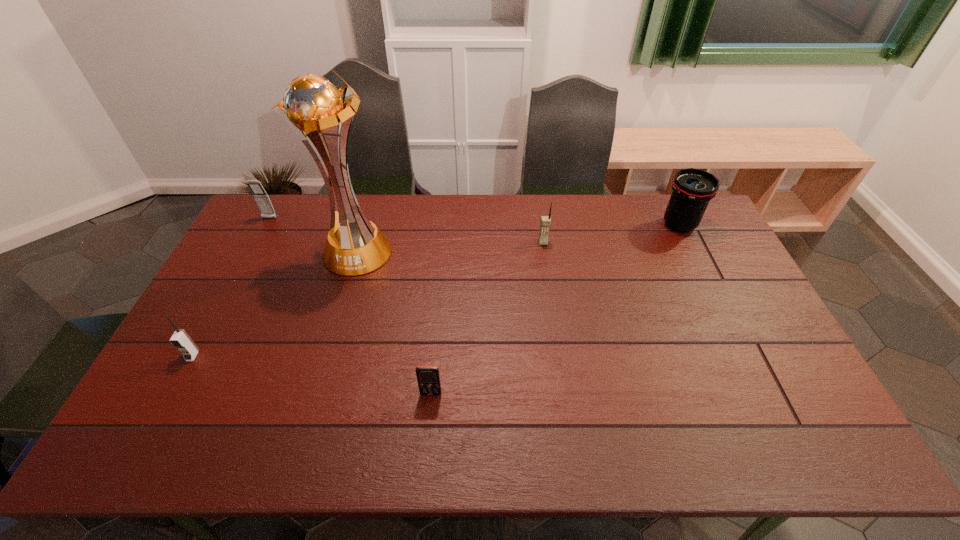
Find the location of a particular element. This screenshot has height=540, width=960. the third object from left to right is located at coordinates (312, 105).

Locate an element on the screen. The height and width of the screenshot is (540, 960). trophy is located at coordinates tap(312, 105).

This screenshot has height=540, width=960. In order to click on the rightmost object in this screenshot , I will do `click(692, 188)`.

The width and height of the screenshot is (960, 540). What are the coordinates of `the farthest cellular telephone` in the screenshot? It's located at (262, 199).

You are a GUI agent. You are given a task and a screenshot of the screen. Output one action in this format:
    pyautogui.click(x=<x>, y=<y>)
    Task: Click on the third nearest cellular telephone
    This screenshot has width=960, height=540.
    Given the screenshot: What is the action you would take?
    pyautogui.click(x=545, y=222)

This screenshot has height=540, width=960. What are the coordinates of `the rightmost cellular telephone` in the screenshot? It's located at (545, 222).

What are the coordinates of `the second nearest object` in the screenshot? It's located at (180, 339).

Where is `the shortest cellular telephone`? The height and width of the screenshot is (540, 960). the shortest cellular telephone is located at coordinates (428, 377).

Identify the location of the third cellular telephone from left to right. The image size is (960, 540). (428, 377).

The width and height of the screenshot is (960, 540). Identify the location of vacant space located on the front-facing side of the tallest object. (320, 381).